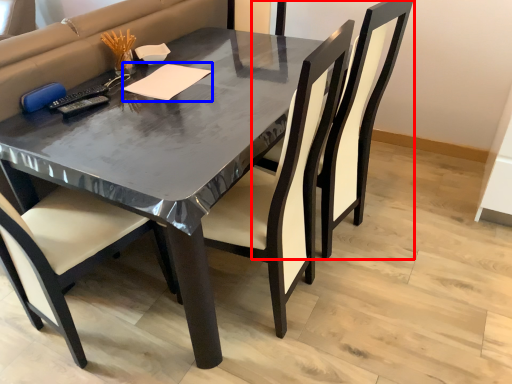
Question: Which point is closer to the camera, chair (highlighted by a red box) or notepad (highlighted by a blue box)?

Choices:
 (A) chair
 (B) notepad

Answer: (A)